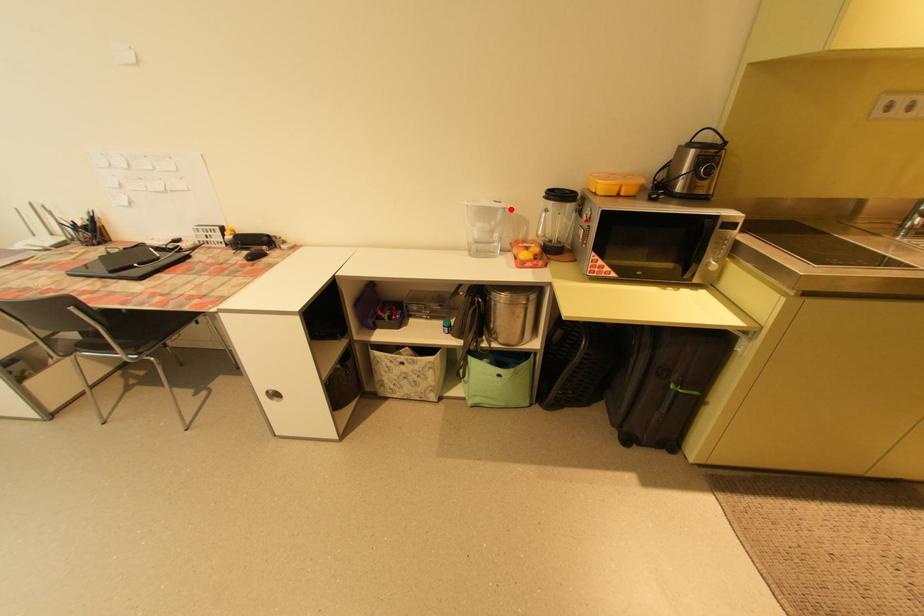
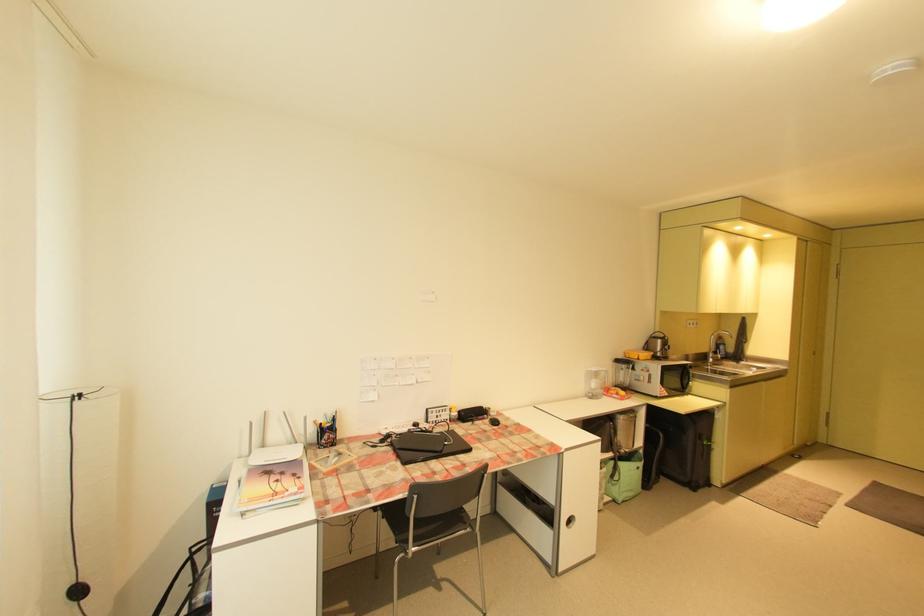
Locate, in the second image, the point that corresponds to the highlighted location in the first image.

(613, 371)